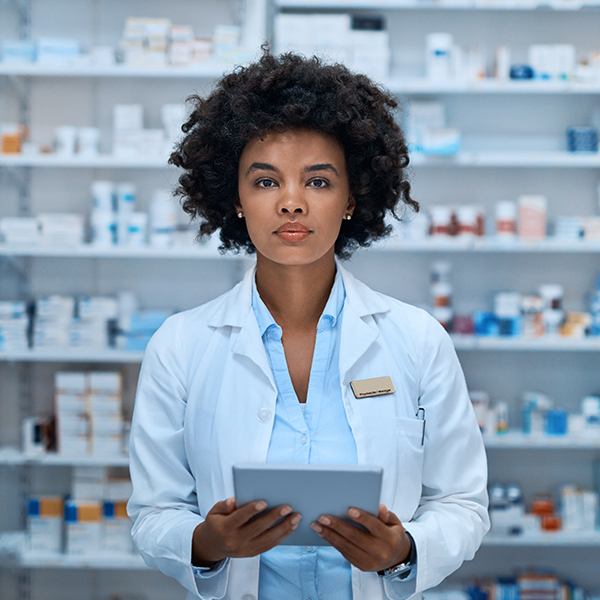
In order to click on pen in this screenshot , I will do `click(416, 416)`.